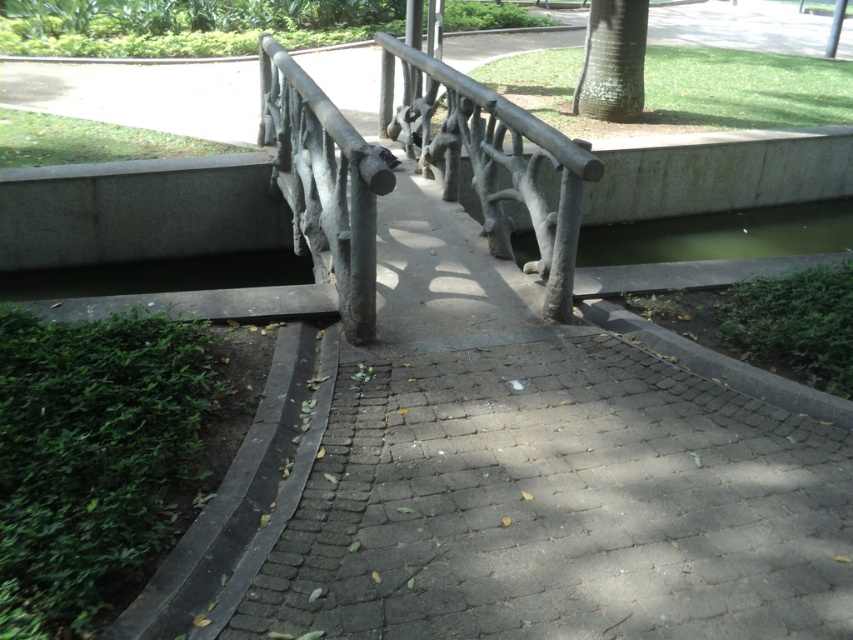
Is rustic wood rail at center taller than white textured bark at upper right?

Yes.

Can you confirm if rustic wood rail at center is thinner than white textured bark at upper right?

No.

Measure the distance between point [503,156] and camera.

Point [503,156] is 4.33 meters from camera.

I want to click on rustic wood rail at center, so click(498, 164).